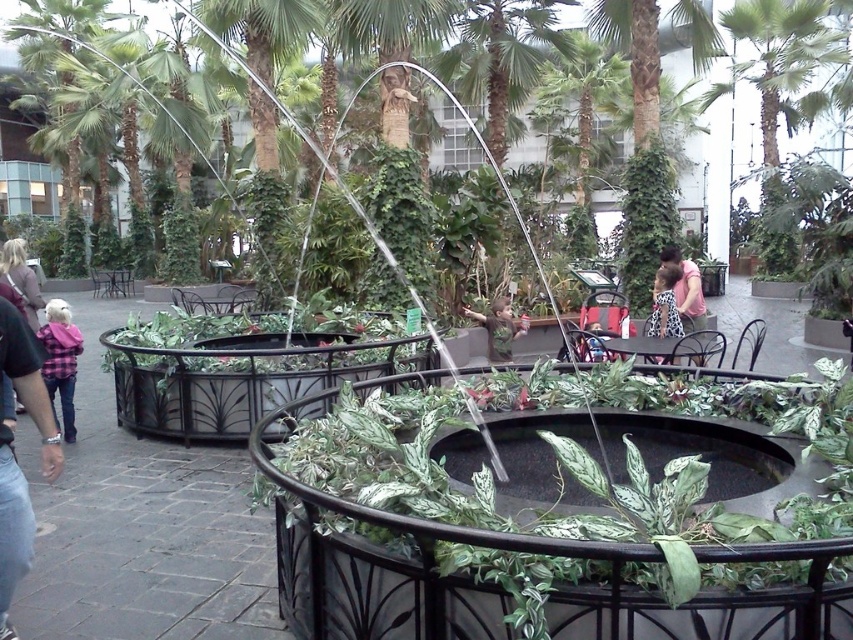
Question: Which of these objects is positioned closest to the matte black jacket at left?

Choices:
 (A) camouflage fabric shirt at center
 (B) matte pink shirt at center
 (C) polka dot skirt at center
 (D) denim jacket at left

Answer: (D)

Question: Is matte black jacket at left positioned behind matte pink shirt at center?

Choices:
 (A) no
 (B) yes

Answer: (A)

Question: Estimate the real-world distances between objects in this image. Which object is closer to the denim jacket at left?

Choices:
 (A) matte black jacket at left
 (B) plaid fabric jacket at left

Answer: (B)

Question: Is denim jacket at left above matte black jacket at left?

Choices:
 (A) no
 (B) yes

Answer: (A)

Question: Which point is closer to the camera?

Choices:
 (A) (0, 564)
 (B) (693, 282)
 (C) (527, 323)
 (D) (44, 372)

Answer: (A)

Question: Considering the relative positions of matte black jacket at left and camouflage fabric shirt at center in the image provided, where is matte black jacket at left located with respect to camouflage fabric shirt at center?

Choices:
 (A) below
 (B) above

Answer: (B)